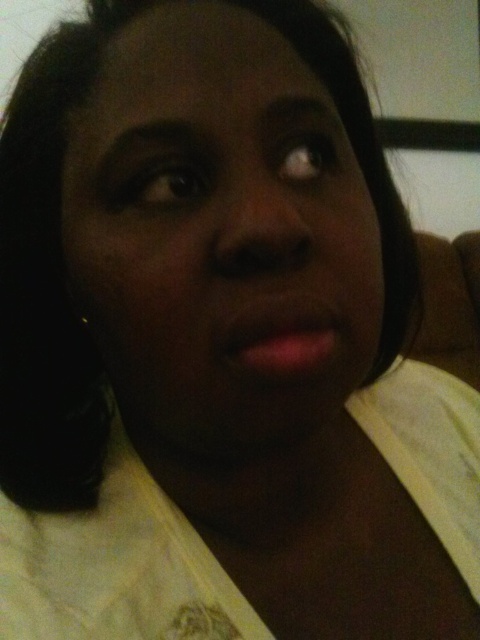
Based on the scene description, which object is positioned higher up on the face between the matte skin face at center and the matte pink lips at center?

The matte skin face at center is taller than the matte pink lips at center, so the matte skin face at center is positioned higher up on the face.

Based on the scene description, if someone is looking at the person in the image, which object would they see first between the matte skin face at center and the matte pink lips at center?

The matte skin face at center is positioned over the matte pink lips at center, so the matte skin face at center would be seen first as it is layered above the matte pink lips at center.

Based on the scene description, can you determine which object is closer to the viewer between the matte skin face at center and the matte pink lips at center?

The matte skin face at center is in front of the matte pink lips at center, so the matte skin face at center is closer to the viewer.